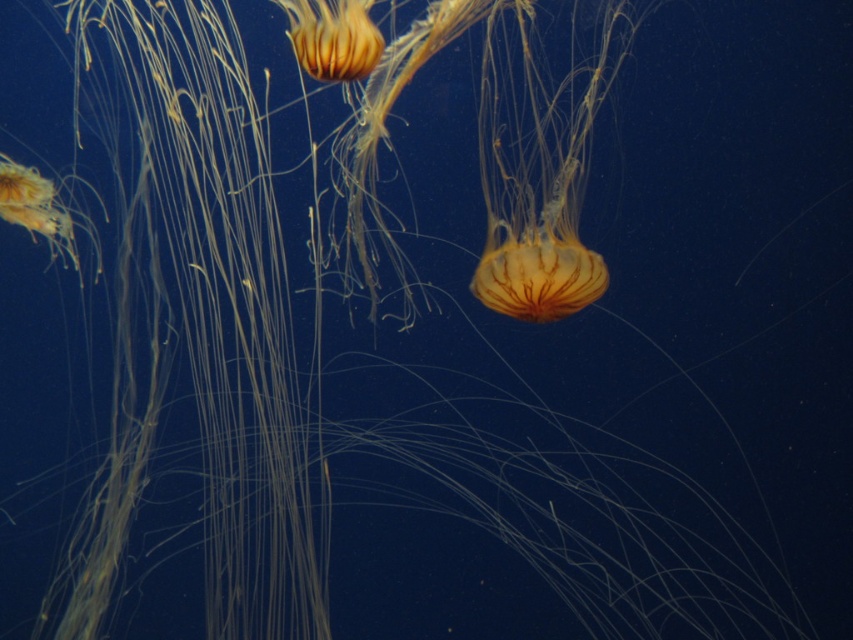
Does translucent orange jellyfish at center have a greater width compared to translucent orange jellyfish at upper center?

Indeed, translucent orange jellyfish at center has a greater width compared to translucent orange jellyfish at upper center.

Does translucent orange jellyfish at center appear on the left side of translucent orange jellyfish at upper center?

No, translucent orange jellyfish at center is not to the left of translucent orange jellyfish at upper center.

Locate an element on the screen. The image size is (853, 640). translucent orange jellyfish at center is located at coordinates (541, 163).

Where is `translucent orange jellyfish at center`? The image size is (853, 640). translucent orange jellyfish at center is located at coordinates (541, 163).